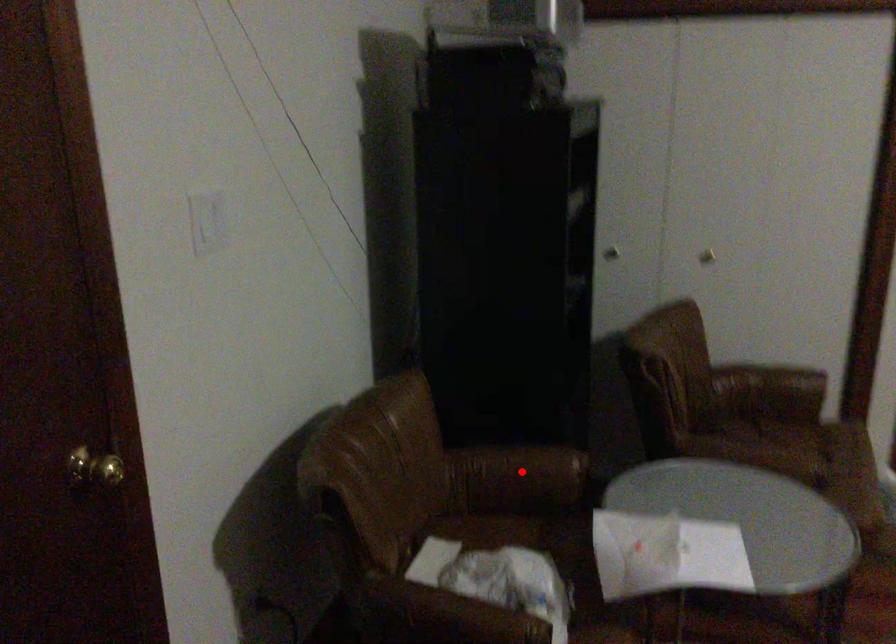
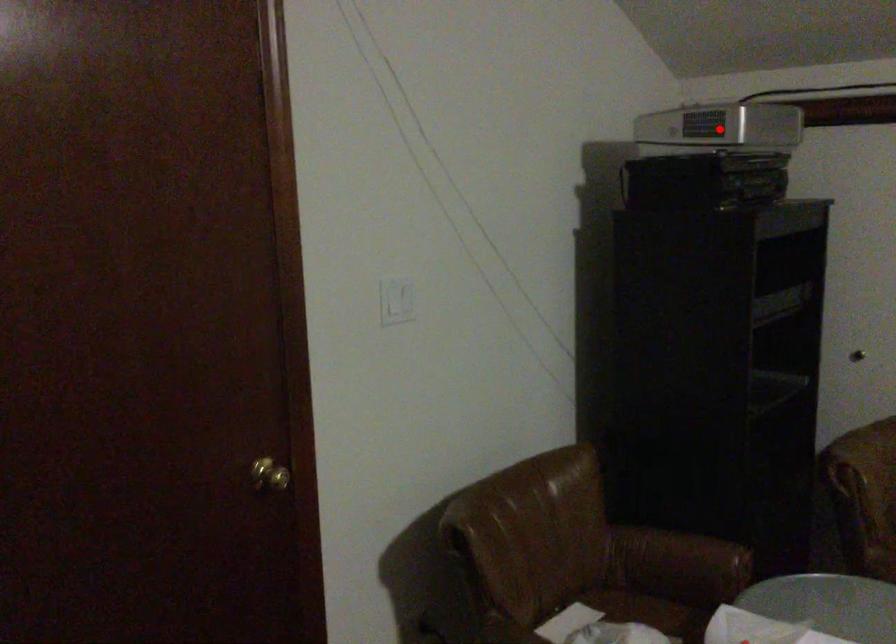
I am providing you with two images of the same scene from different viewpoints. A red point is marked on the first image and another point is marked on the second image. Is the red point in image1 aligned with the point shown in image2?

No